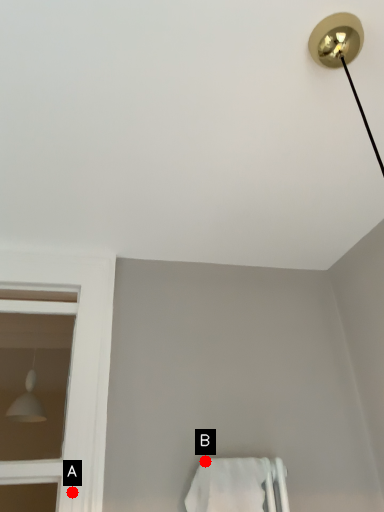
Question: Two points are circled on the image, labeled by A and B beside each circle. Which point is closer to the camera?

Choices:
 (A) A is closer
 (B) B is closer

Answer: (A)